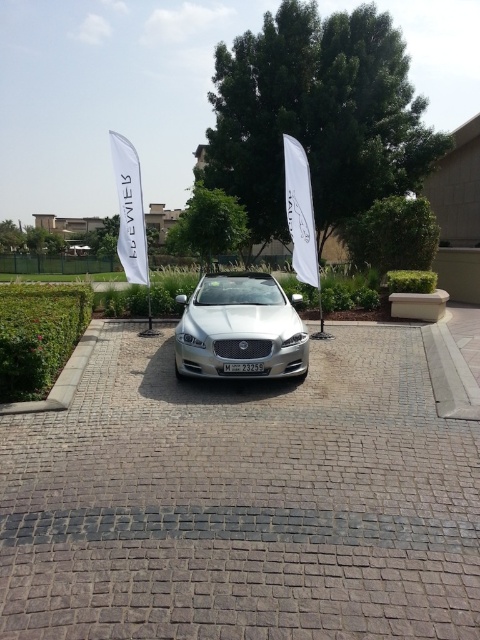
Question: Which of the following is the closest to the observer?

Choices:
 (A) white fabric flag at center
 (B) gray cobblestone driveway at center
 (C) white fabric canopy at left

Answer: (B)

Question: Does gray cobblestone driveway at center appear on the right side of silver metallic car at center?

Choices:
 (A) yes
 (B) no

Answer: (A)

Question: Which point is closer to the camera?

Choices:
 (A) white fabric canopy at left
 (B) white fabric flag at center
 (C) gray cobblestone driveway at center
 (D) black plastic license plate at center

Answer: (C)

Question: Is gray cobblestone driveway at center to the right of white fabric canopy at left from the viewer's perspective?

Choices:
 (A) yes
 (B) no

Answer: (A)

Question: Estimate the real-world distances between objects in this image. Which object is closer to the white fabric flag at center?

Choices:
 (A) gray cobblestone driveway at center
 (B) silver metallic car at center
 (C) white fabric canopy at left
 (D) black plastic license plate at center

Answer: (B)

Question: Can you confirm if white fabric canopy at left is thinner than white fabric flag at center?

Choices:
 (A) no
 (B) yes

Answer: (A)